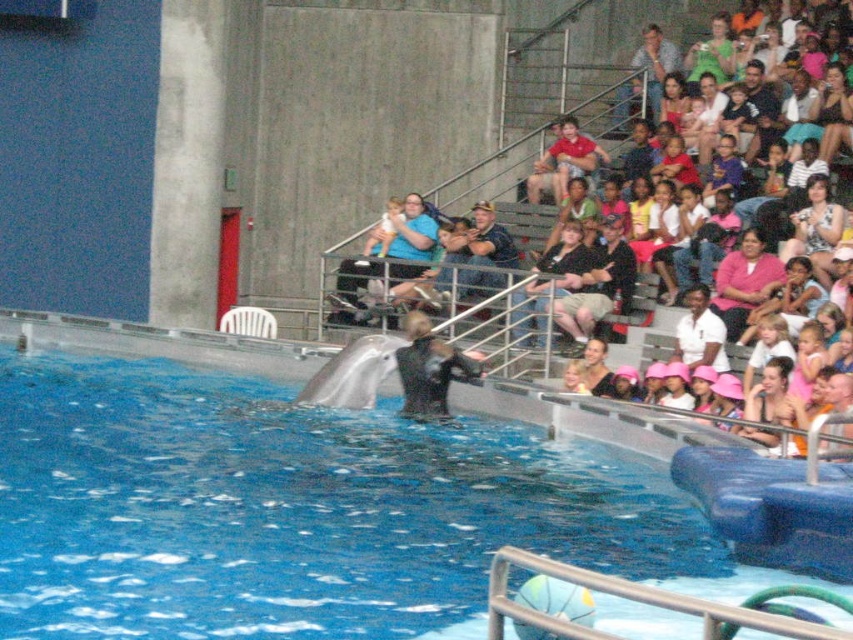
Question: Which point appears closest to the camera in this image?

Choices:
 (A) (570, 276)
 (B) (705, 342)

Answer: (B)

Question: Is matte black dolphin at center smaller than white smooth dolphin at center?

Choices:
 (A) yes
 (B) no

Answer: (B)

Question: Which object appears closest to the camera in this image?

Choices:
 (A) matte black dolphin at center
 (B) matte black shirt at center
 (C) pink matte shirt at upper right
 (D) white cotton shirt at upper right

Answer: (A)

Question: Is black wetsuit at center wider than white cotton shirt at upper right?

Choices:
 (A) no
 (B) yes

Answer: (B)

Question: Is blue rubber swimming pool at center to the right of matte black dolphin at center from the viewer's perspective?

Choices:
 (A) yes
 (B) no

Answer: (B)

Question: Estimate the real-world distances between objects in this image. Which object is closer to the blue rubber swimming pool at center?

Choices:
 (A) white smooth dolphin at center
 (B) pink matte shirt at upper right
 (C) black wetsuit at center

Answer: (A)